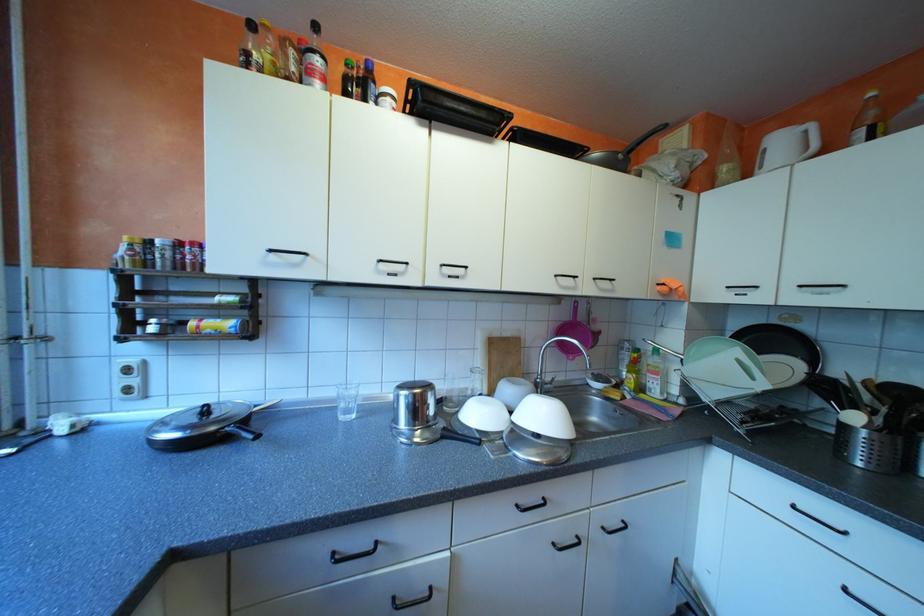
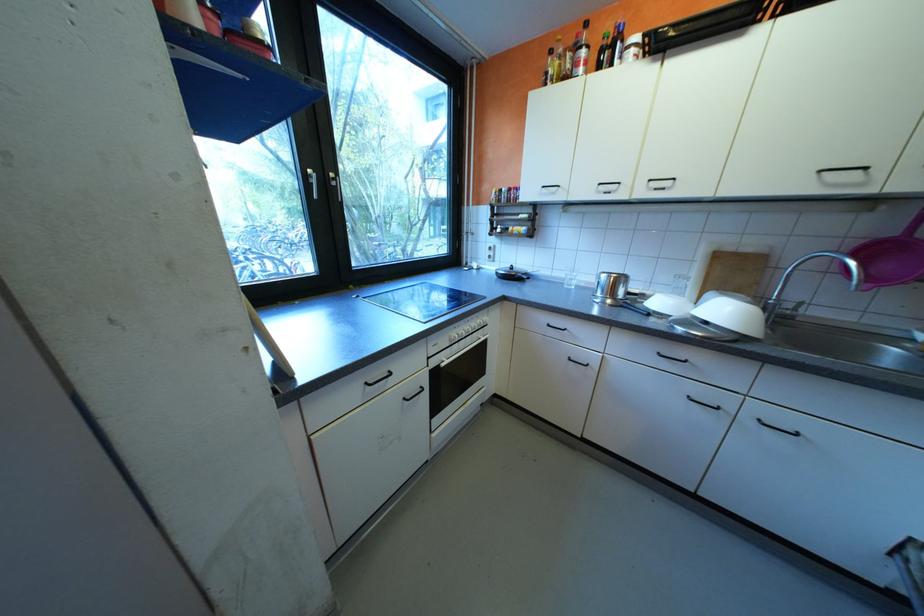
The point at (305, 68) is marked in the first image. Where is the corresponding point in the second image?

(580, 65)